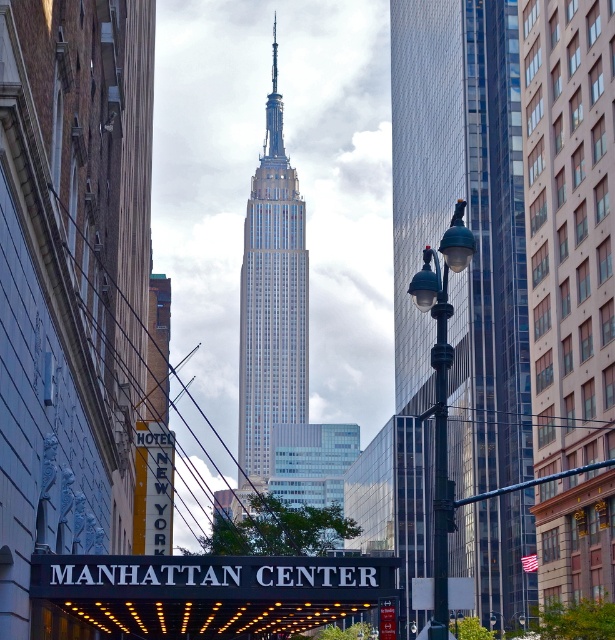
Question: Which point is closer to the camera?

Choices:
 (A) glassy steel skyscraper at center
 (B) white glass skyscraper at center

Answer: (A)

Question: Does glassy steel skyscraper at center appear under white glass skyscraper at center?

Choices:
 (A) no
 (B) yes

Answer: (B)

Question: Is white glass skyscraper at center positioned in front of green glass streetlight at center?

Choices:
 (A) yes
 (B) no

Answer: (B)

Question: From the image, what is the correct spatial relationship of glassy steel skyscraper at center in relation to white glass skyscraper at center?

Choices:
 (A) left
 (B) right

Answer: (B)

Question: Which object is positioned farthest from the green glass streetlight at center?

Choices:
 (A) glassy steel skyscraper at center
 (B) white glass skyscraper at center

Answer: (B)

Question: Which point is farther to the camera?

Choices:
 (A) green glass streetlight at center
 (B) white glass skyscraper at center

Answer: (B)